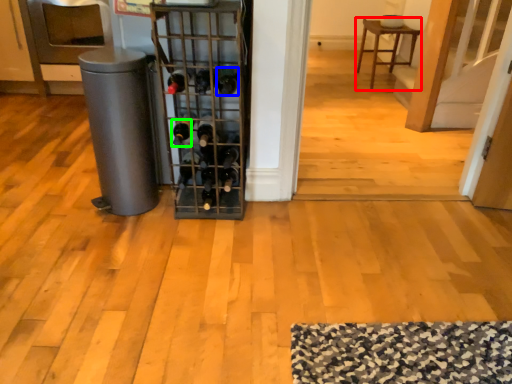
Question: Considering the real-world distances, which object is farthest from furniture (highlighted by a red box)? wine bottle (highlighted by a blue box) or wine bottle (highlighted by a green box)?

Choices:
 (A) wine bottle
 (B) wine bottle

Answer: (B)